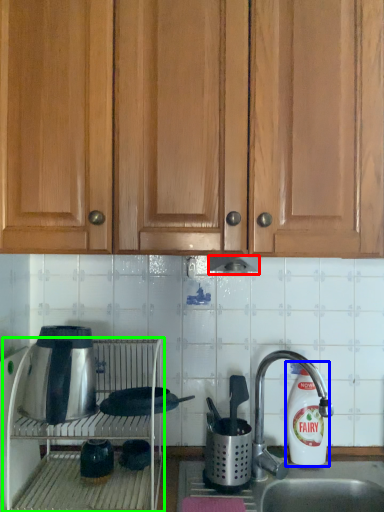
Question: Based on their relative distances, which object is farther from exhaust hood (highlighted by a red box)? Choose from cleaning product (highlighted by a blue box) and oven (highlighted by a green box).

Choices:
 (A) cleaning product
 (B) oven

Answer: (B)